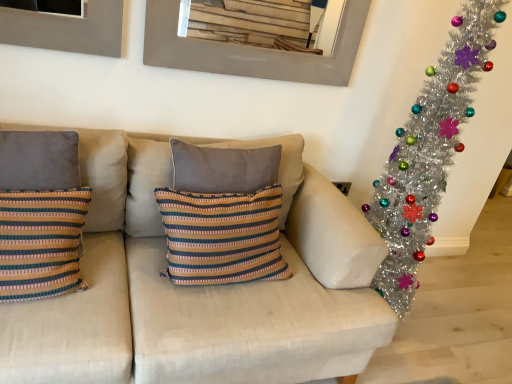
Question: Is textured beige couch at center a part of striped fabric pillow at left, arranged as the second pillow when viewed from the right?

Choices:
 (A) no
 (B) yes

Answer: (A)

Question: Is striped fabric pillow at left, the first pillow viewed from the left, to the left of textured beige couch at center from the viewer's perspective?

Choices:
 (A) yes
 (B) no

Answer: (A)

Question: Is striped fabric pillow at left, arranged as the second pillow when viewed from the right, oriented towards textured beige couch at center?

Choices:
 (A) no
 (B) yes

Answer: (B)

Question: From a real-world perspective, is striped fabric pillow at left, the first pillow viewed from the left, physically above textured beige couch at center?

Choices:
 (A) yes
 (B) no

Answer: (A)

Question: Can you confirm if striped fabric pillow at left, arranged as the second pillow when viewed from the right, is shorter than textured beige couch at center?

Choices:
 (A) no
 (B) yes

Answer: (B)

Question: From a real-world perspective, relative to textured beige couch at center, is metallic gray picture frame at upper center vertically above or below?

Choices:
 (A) below
 (B) above

Answer: (B)

Question: Is metallic gray picture frame at upper center spatially inside textured beige couch at center, or outside of it?

Choices:
 (A) inside
 (B) outside

Answer: (B)

Question: In terms of height, does metallic gray picture frame at upper center look taller or shorter compared to textured beige couch at center?

Choices:
 (A) tall
 (B) short

Answer: (B)

Question: Looking at their shapes, would you say metallic gray picture frame at upper center is wider or thinner than textured beige couch at center?

Choices:
 (A) thin
 (B) wide

Answer: (A)

Question: From a real-world perspective, is shiny silver tinsel garland at right positioned above or below metallic gray picture frame at upper center?

Choices:
 (A) below
 (B) above

Answer: (A)

Question: In terms of size, does shiny silver tinsel garland at right appear bigger or smaller than metallic gray picture frame at upper center?

Choices:
 (A) small
 (B) big

Answer: (B)

Question: Considering the positions of shiny silver tinsel garland at right and metallic gray picture frame at upper center in the image, is shiny silver tinsel garland at right wider or thinner than metallic gray picture frame at upper center?

Choices:
 (A) thin
 (B) wide

Answer: (B)

Question: Is shiny silver tinsel garland at right taller or shorter than metallic gray picture frame at upper center?

Choices:
 (A) short
 (B) tall

Answer: (B)

Question: Considering the positions of metallic gray picture frame at upper center and striped fabric cushion at center, which is the first pillow from right to left, in the image, is metallic gray picture frame at upper center taller or shorter than striped fabric cushion at center, which is the first pillow from right to left,?

Choices:
 (A) tall
 (B) short

Answer: (B)

Question: Is metallic gray picture frame at upper center bigger or smaller than striped fabric cushion at center, which is the first pillow from right to left?

Choices:
 (A) small
 (B) big

Answer: (A)